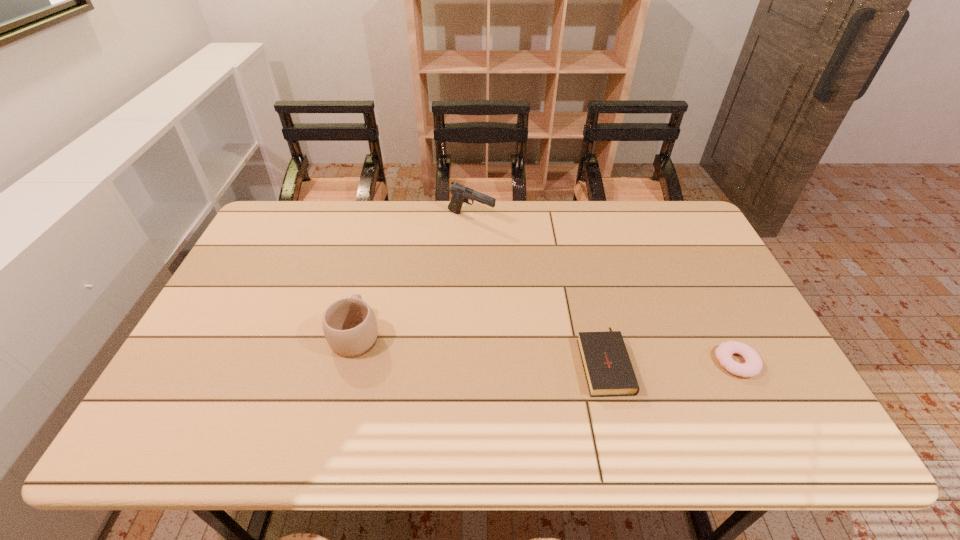
In the image, there is a desktop. Identify the location of free space at the far right corner. (704, 239).

In order to click on free space between the rightmost object and the leftmost object in this screenshot , I will do `click(546, 348)`.

Identify the location of free space that is in between the shortest object and the third tallest object. (670, 361).

Identify the location of unoccupied area between the second tallest object and the third object from right to left. (414, 276).

At what (x,y) coordinates should I click in order to perform the action: click on vacant space in between the shortest object and the gun. Please return your answer as a coordinate pair (x, y). Image resolution: width=960 pixels, height=540 pixels. Looking at the image, I should click on (604, 291).

In order to click on vacant space that is in between the Bible and the leftmost object in this screenshot , I will do `click(480, 347)`.

At what (x,y) coordinates should I click in order to perform the action: click on free spot between the mug and the rightmost object. Please return your answer as a coordinate pair (x, y). This screenshot has width=960, height=540. Looking at the image, I should click on (546, 348).

At what (x,y) coordinates should I click in order to perform the action: click on free space between the Bible and the tallest object. Please return your answer as a coordinate pair (x, y). The image size is (960, 540). Looking at the image, I should click on (538, 289).

At what (x,y) coordinates should I click in order to perform the action: click on unoccupied area between the shortest object and the gun. Please return your answer as a coordinate pair (x, y). Looking at the image, I should click on (604, 291).

Find the location of a particular element. blank region between the shortest object and the farthest object is located at coordinates (604, 291).